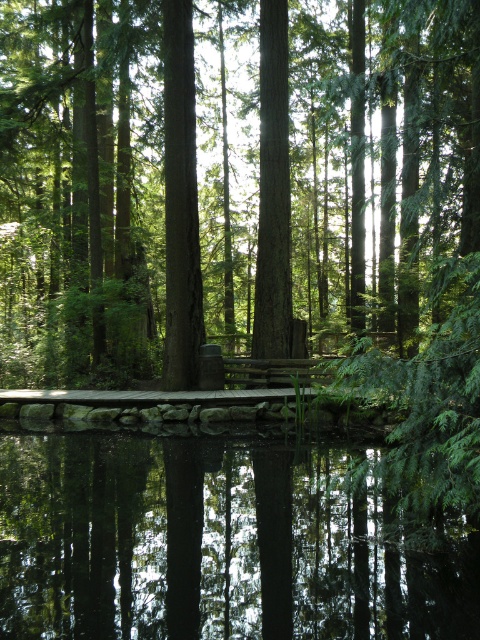
You are a photographer wanting to capture the green matte tree at center and transparent water at center in a single frame. Which object will appear larger in your photo?

The green matte tree at center will appear larger in the photo because it is bigger than the transparent water at center according to the description.

You are standing at the center of the forest and see the green matte tree at center. If you walk 0.287 meters north and 0.475 meters east, where will you be?

You will be at the position of the green matte tree at center since its coordinates are at point (228, 182).